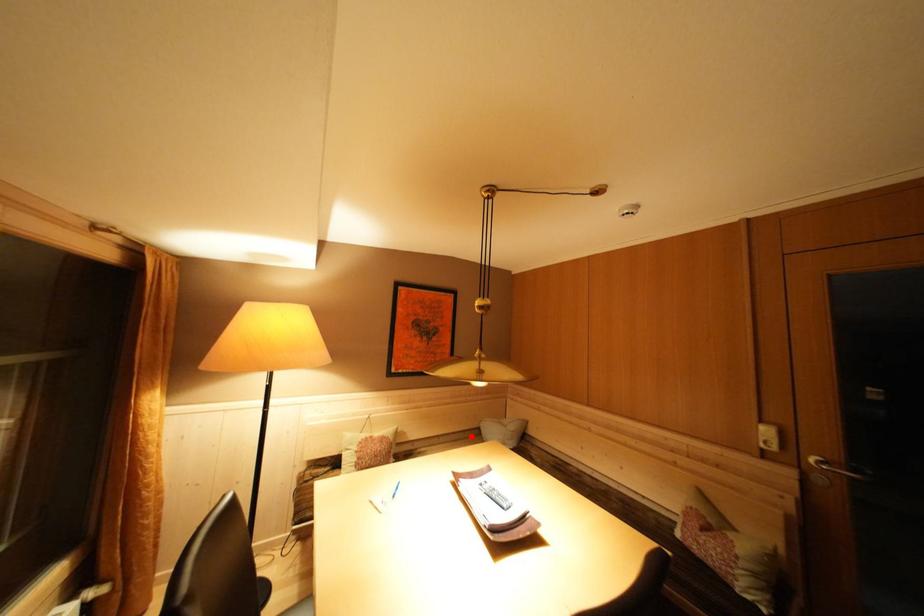
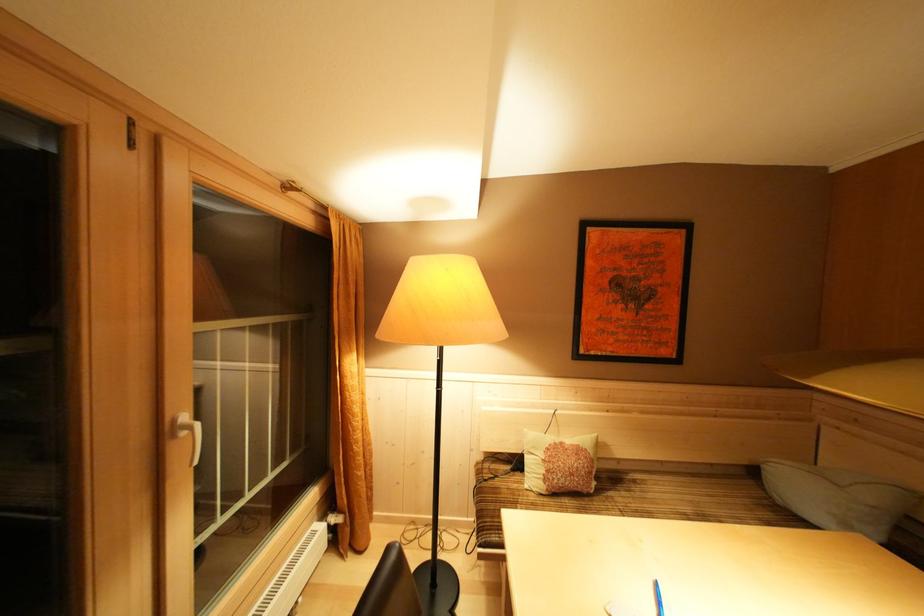
Question: I am providing you with two images of the same scene from different viewpoints. In image1, a red point is highlighted. Considering the same 3D point in image2, which of the following is correct?

Choices:
 (A) It is closer
 (B) It is farther

Answer: (A)